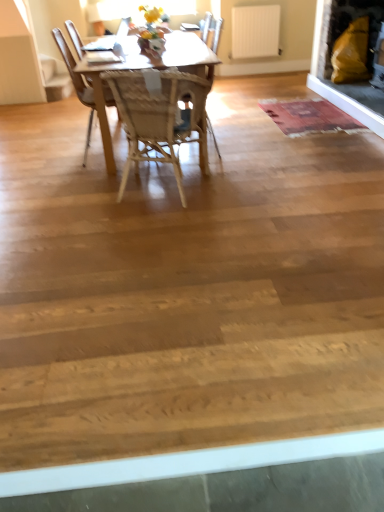
Image resolution: width=384 pixels, height=512 pixels. Find the location of `free space to the right of woven wood chair at center, which is the first chair from front to back`. free space to the right of woven wood chair at center, which is the first chair from front to back is located at coordinates (257, 181).